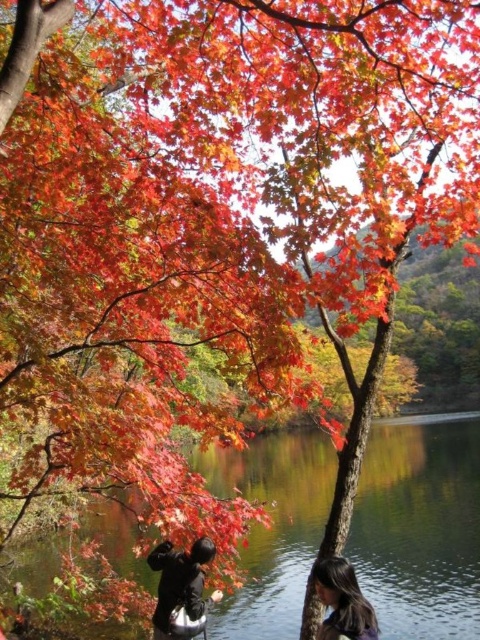
Can you confirm if clear water at center is taller than black matte jacket at lower center?

Correct, clear water at center is much taller as black matte jacket at lower center.

Locate an element on the screen. Image resolution: width=480 pixels, height=640 pixels. clear water at center is located at coordinates (420, 525).

Based on the photo, does black matte jacket at lower center have a lesser height compared to smooth brown hair at lower right?

In fact, black matte jacket at lower center may be taller than smooth brown hair at lower right.

Is point (175, 592) more distant than point (357, 592)?

Yes, it is behind point (357, 592).

You are a GUI agent. You are given a task and a screenshot of the screen. Output one action in this format:
    pyautogui.click(x=<x>, y=<y>)
    Task: Click on the black matte jacket at lower center
    This screenshot has height=640, width=480.
    Given the screenshot: What is the action you would take?
    pyautogui.click(x=180, y=582)

Locate an element on the screen. Image resolution: width=480 pixels, height=640 pixels. black matte jacket at lower center is located at coordinates (180, 582).

Is clear water at center bigger than smooth brown hair at lower right?

Indeed, clear water at center has a larger size compared to smooth brown hair at lower right.

Between point (392, 531) and point (326, 595), which one is positioned in front?

Positioned in front is point (326, 595).

The height and width of the screenshot is (640, 480). What are the coordinates of `clear water at center` in the screenshot? It's located at [420, 525].